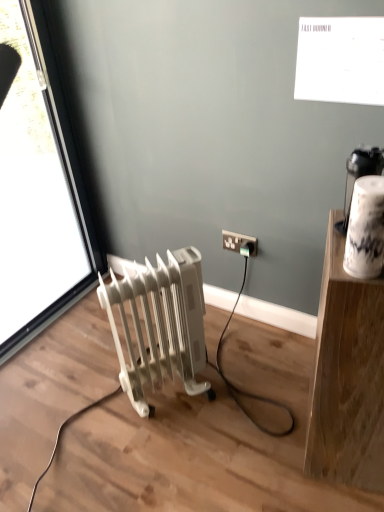
Question: Does white plastic radiator at lower left have a larger size compared to white plastic socket at lower right?

Choices:
 (A) no
 (B) yes

Answer: (B)

Question: Is white plastic radiator at lower left not inside white plastic socket at lower right?

Choices:
 (A) yes
 (B) no

Answer: (A)

Question: Is white plastic radiator at lower left closer to the viewer compared to white plastic socket at lower right?

Choices:
 (A) yes
 (B) no

Answer: (A)

Question: From a real-world perspective, is white plastic radiator at lower left physically above white plastic socket at lower right?

Choices:
 (A) no
 (B) yes

Answer: (A)

Question: From a real-world perspective, is white plastic radiator at lower left under white plastic socket at lower right?

Choices:
 (A) yes
 (B) no

Answer: (A)

Question: Based on their positions, is white plastic socket at lower right located to the left or right of white plastic radiator at lower left?

Choices:
 (A) right
 (B) left

Answer: (A)

Question: From the image's perspective, is white plastic socket at lower right located above or below white plastic radiator at lower left?

Choices:
 (A) below
 (B) above

Answer: (B)

Question: Is point (228, 246) closer or farther from the camera than point (178, 282)?

Choices:
 (A) closer
 (B) farther

Answer: (B)

Question: Considering the positions of white plastic socket at lower right and white plastic radiator at lower left in the image, is white plastic socket at lower right bigger or smaller than white plastic radiator at lower left?

Choices:
 (A) big
 (B) small

Answer: (B)

Question: From the image's perspective, is white wood shelf at upper right positioned above or below transparent glass window at left?

Choices:
 (A) above
 (B) below

Answer: (B)

Question: Is white wood shelf at upper right spatially inside transparent glass window at left, or outside of it?

Choices:
 (A) inside
 (B) outside

Answer: (B)

Question: Considering the positions of white wood shelf at upper right and transparent glass window at left in the image, is white wood shelf at upper right taller or shorter than transparent glass window at left?

Choices:
 (A) tall
 (B) short

Answer: (B)

Question: In the image, is white wood shelf at upper right positioned in front of or behind transparent glass window at left?

Choices:
 (A) behind
 (B) front

Answer: (B)

Question: In terms of size, does white plastic radiator at lower left appear bigger or smaller than white wood shelf at upper right?

Choices:
 (A) big
 (B) small

Answer: (B)

Question: Is white plastic radiator at lower left to the left or to the right of white wood shelf at upper right in the image?

Choices:
 (A) right
 (B) left

Answer: (B)